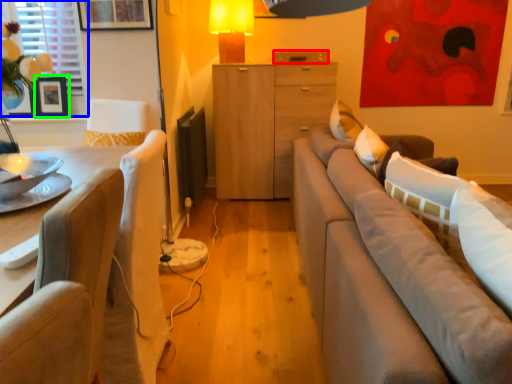
Question: Which object is positioned farthest from drawer (highlighted by a red box)? Select from window screen (highlighted by a blue box) and picture frame (highlighted by a green box).

Choices:
 (A) window screen
 (B) picture frame

Answer: (B)